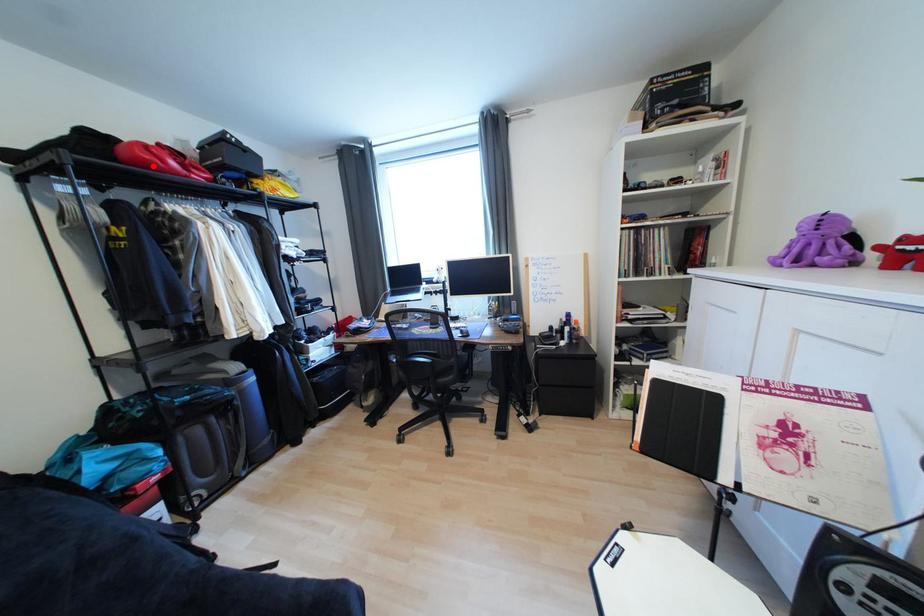
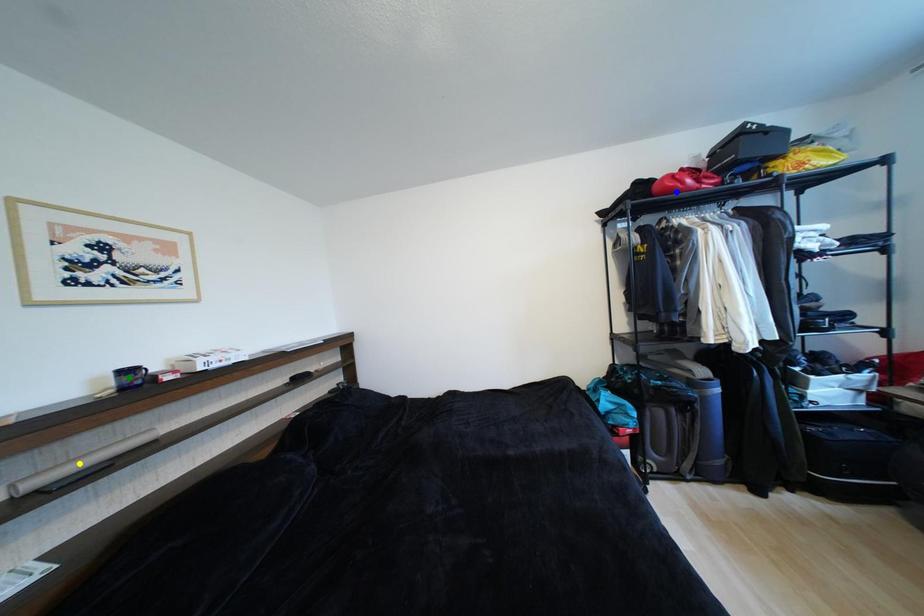
Question: I am providing you with two images of the same scene from different viewpoints. A red point is marked on the first image. You are given multiple points on the second image. Which point in image 2 is actually the same real-world point as the red point in image 1?

Choices:
 (A) blue point
 (B) yellow point
 (C) green point

Answer: (A)